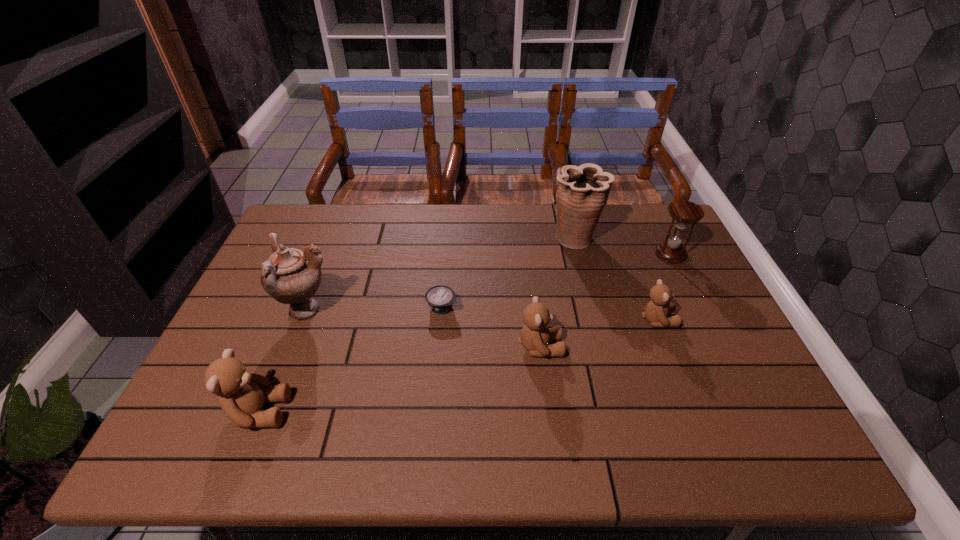
I want to click on the shortest object, so click(440, 298).

Image resolution: width=960 pixels, height=540 pixels. What are the coordinates of `yogurt` in the screenshot? It's located at (440, 298).

Image resolution: width=960 pixels, height=540 pixels. Identify the location of free region located 0.390m on the face of the nearest teddy bear. (461, 411).

Identify the location of vacant space located 0.280m on the face of the fourth object from left to right. (x=672, y=347).

The width and height of the screenshot is (960, 540). In order to click on free space located 0.100m on the face of the second shortest object in this screenshot , I will do `click(711, 320)`.

Identify the location of vacant space positioned 0.200m on the left of the farther urn. [x=488, y=238].

The width and height of the screenshot is (960, 540). Find the location of `blank space located on the right of the nearer urn`. blank space located on the right of the nearer urn is located at coordinates (373, 311).

Locate an element on the screen. blank space located on the left of the hourglass is located at coordinates pyautogui.click(x=550, y=254).

Image resolution: width=960 pixels, height=540 pixels. Identify the location of vacant space positioned on the left of the shortest object. (366, 307).

Where is `urn that is positioned at the far edge`? Image resolution: width=960 pixels, height=540 pixels. urn that is positioned at the far edge is located at coordinates (583, 191).